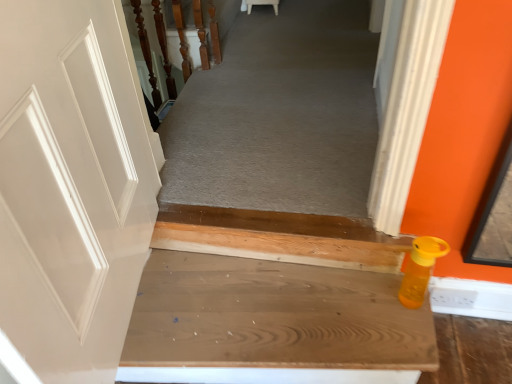
Image resolution: width=512 pixels, height=384 pixels. Identify the location of orange matte bottle at lower right. (420, 269).

Is wooden at upper left far away from wooden stairs at lower right?

Yes, wooden at upper left is far from wooden stairs at lower right.

Between wooden at upper left and wooden stairs at lower right, which one has less height?

With less height is wooden stairs at lower right.

Which object is closer to the camera taking this photo, wooden at upper left or wooden stairs at lower right?

Positioned in front is wooden stairs at lower right.

This screenshot has height=384, width=512. What are the coordinates of `rail located on the left of wooden stairs at lower right` in the screenshot? It's located at (146, 51).

Which of these two, orange matte bottle at lower right or wooden at upper left, is smaller?

With smaller size is orange matte bottle at lower right.

Is orange matte bottle at lower right taller or shorter than wooden at upper left?

Clearly, orange matte bottle at lower right is shorter compared to wooden at upper left.

From a real-world perspective, who is located lower, orange matte bottle at lower right or wooden stairs at lower right?

wooden stairs at lower right.

Would you say wooden stairs at lower right is part of orange matte bottle at lower right's contents?

Definitely not — wooden stairs at lower right is not inside orange matte bottle at lower right.

Relative to wooden stairs at lower right, is orange matte bottle at lower right in front or behind?

orange matte bottle at lower right is positioned farther from the viewer than wooden stairs at lower right.

Can you confirm if orange matte bottle at lower right is taller than wooden stairs at lower right?

Yes.

From the image's perspective, which object appears higher, wooden at upper left or orange matte bottle at lower right?

wooden at upper left is shown above in the image.

Between wooden at upper left and orange matte bottle at lower right, which one appears on the left side from the viewer's perspective?

From the viewer's perspective, wooden at upper left appears more on the left side.

From a real-world perspective, which object stands above the other?

wooden at upper left is physically above.

Are wooden at upper left and orange matte bottle at lower right making contact?

They are not placed beside each other.

Is wooden stairs at lower right spatially inside orange matte bottle at lower right, or outside of it?

wooden stairs at lower right exists outside the volume of orange matte bottle at lower right.

From the image's perspective, is wooden stairs at lower right located above orange matte bottle at lower right?

No, from the image's perspective, wooden stairs at lower right is not on top of orange matte bottle at lower right.

From a real-world perspective, is wooden stairs at lower right positioned under orange matte bottle at lower right based on gravity?

Correct, in the physical world, wooden stairs at lower right is lower than orange matte bottle at lower right.

Is wooden stairs at lower right in front of orange matte bottle at lower right?

Yes, wooden stairs at lower right is in front of orange matte bottle at lower right.

Is wooden stairs at lower right at the right side of wooden at upper left?

Yes, wooden stairs at lower right is to the right of wooden at upper left.

Considering the sizes of objects wooden stairs at lower right and wooden at upper left in the image provided, who is shorter, wooden stairs at lower right or wooden at upper left?

Standing shorter between the two is wooden stairs at lower right.

Is wooden stairs at lower right spatially inside wooden at upper left, or outside of it?

wooden stairs at lower right is spatially situated outside wooden at upper left.

From the image's perspective, is wooden stairs at lower right above or below wooden at upper left?

From the image's perspective, wooden stairs at lower right appears below wooden at upper left.

In order to click on stairs on the right of wooden at upper left in this screenshot , I will do `click(273, 302)`.

At what (x,y) coordinates should I click in order to perform the action: click on bottle in front of the wooden at upper left. Please return your answer as a coordinate pair (x, y). Looking at the image, I should click on pos(420,269).

Considering their positions, is wooden at upper left positioned closer to wooden stairs at lower right than orange matte bottle at lower right?

Based on the image, orange matte bottle at lower right appears to be nearer to wooden stairs at lower right.

Which object lies further to the anchor point wooden stairs at lower right, orange matte bottle at lower right or wooden at upper left?

Among the two, wooden at upper left is located further to wooden stairs at lower right.

From the image, which object appears to be farther from wooden at upper left, wooden stairs at lower right or orange matte bottle at lower right?

orange matte bottle at lower right is further to wooden at upper left.

Estimate the real-world distances between objects in this image. Which object is closer to wooden at upper left, orange matte bottle at lower right or wooden stairs at lower right?

Based on the image, wooden stairs at lower right appears to be nearer to wooden at upper left.

Looking at the image, which one is located further to orange matte bottle at lower right, wooden at upper left or wooden stairs at lower right?

Based on the image, wooden at upper left appears to be further to orange matte bottle at lower right.

Looking at the image, which one is located further to orange matte bottle at lower right, wooden stairs at lower right or wooden at upper left?

Based on the image, wooden at upper left appears to be further to orange matte bottle at lower right.

The width and height of the screenshot is (512, 384). I want to click on bottle between wooden at upper left and wooden stairs at lower right in the up-down direction, so click(x=420, y=269).